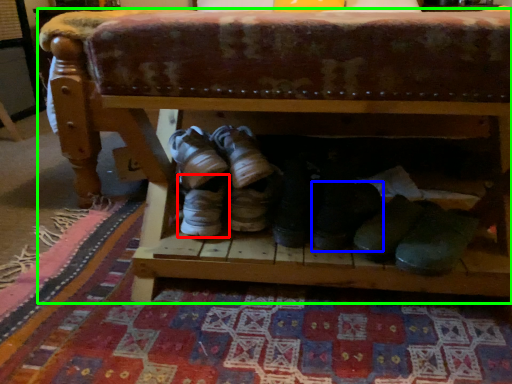
Question: Considering the real-world distances, which object is closest to footwear (highlighted by a red box)? footwear (highlighted by a blue box) or furniture (highlighted by a green box).

Choices:
 (A) footwear
 (B) furniture

Answer: (A)